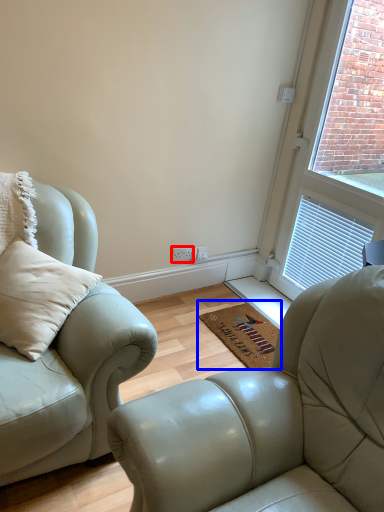
Question: Which point is further to the camera, electric outlet (highlighted by a red box) or doormat (highlighted by a blue box)?

Choices:
 (A) electric outlet
 (B) doormat

Answer: (A)